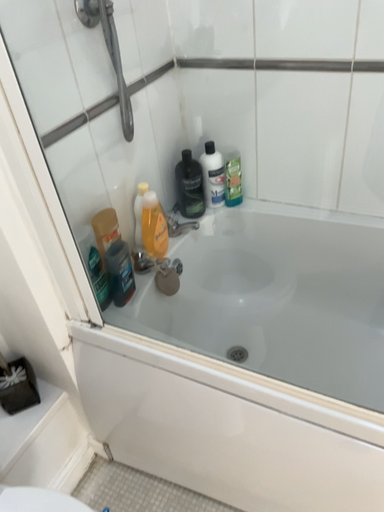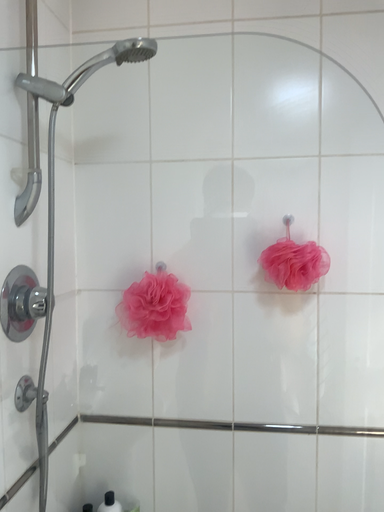
Question: Which way did the camera rotate in the video?

Choices:
 (A) rotated right
 (B) rotated left

Answer: (A)